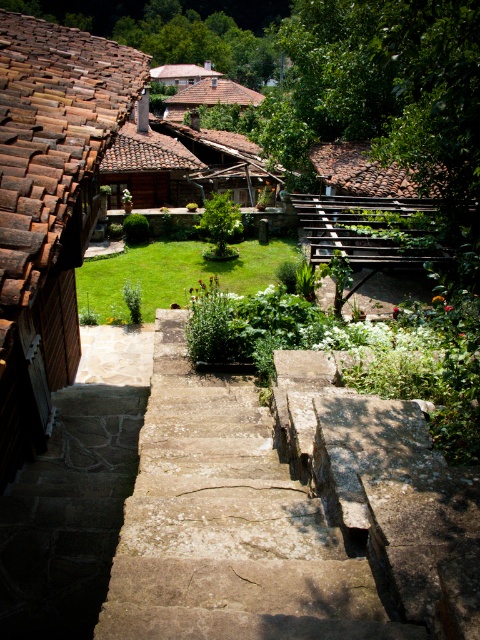
Does rustic stone steps at center appear on the right side of brown tiled roof at upper center?

Indeed, rustic stone steps at center is positioned on the right side of brown tiled roof at upper center.

Can you confirm if rustic stone steps at center is positioned below brown tiled roof at upper center?

Yes.

Is point (95, 384) positioned behind point (184, 68)?

No, (95, 384) is in front of (184, 68).

Where is `rustic stone steps at center`? This screenshot has width=480, height=640. rustic stone steps at center is located at coordinates (75, 492).

Which is more to the left, stone stairs at center or brown tiled roof at upper center?

From the viewer's perspective, brown tiled roof at upper center appears more on the left side.

Is point (171, 492) less distant than point (213, 76)?

Yes.

Identify the location of stone stairs at center. (227, 525).

Is the position of stone stairs at center less distant than that of rustic clay roof tiles at left?

Yes, it is.

Describe the element at coordinates (227, 525) in the screenshot. I see `stone stairs at center` at that location.

The image size is (480, 640). In order to click on stone stairs at center in this screenshot , I will do `click(227, 525)`.

This screenshot has width=480, height=640. Identify the location of stone stairs at center. (227, 525).